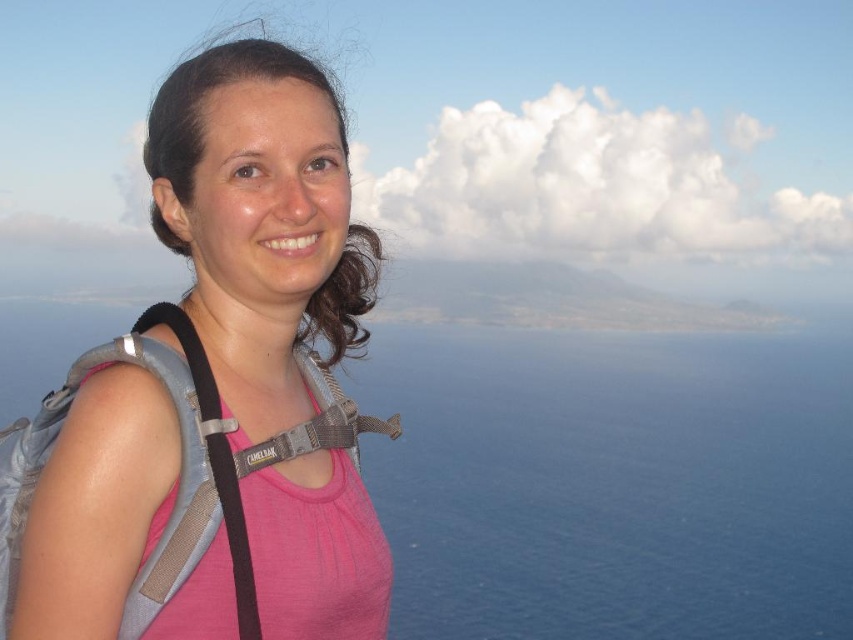
Which is above, blue water at center or pink fabric shirt at left?

Positioned higher is pink fabric shirt at left.

You are a GUI agent. You are given a task and a screenshot of the screen. Output one action in this format:
    pyautogui.click(x=<x>, y=<y>)
    Task: Click on the blue water at center
    The width and height of the screenshot is (853, 640).
    Given the screenshot: What is the action you would take?
    pyautogui.click(x=613, y=483)

Where is `blue water at center`? The image size is (853, 640). blue water at center is located at coordinates (613, 483).